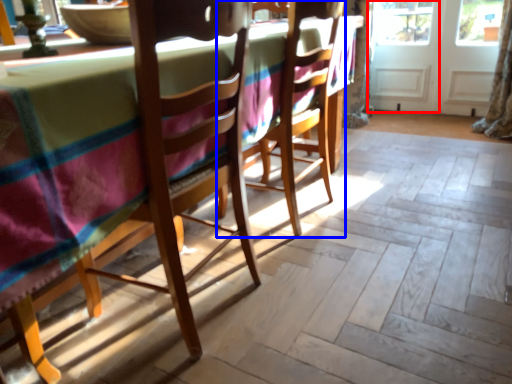
Question: Which object is further to the camera taking this photo, screen door (highlighted by a red box) or chair (highlighted by a blue box)?

Choices:
 (A) screen door
 (B) chair

Answer: (A)